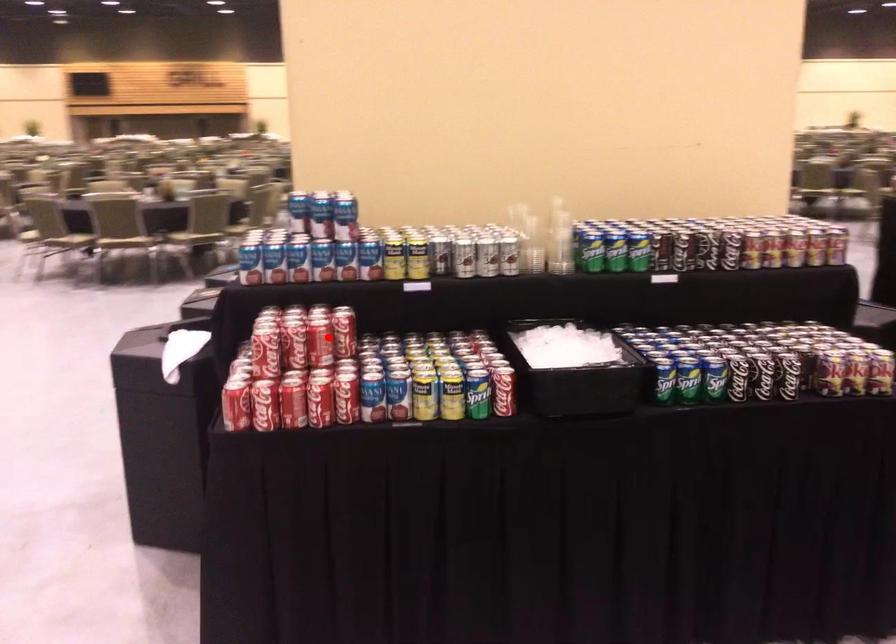
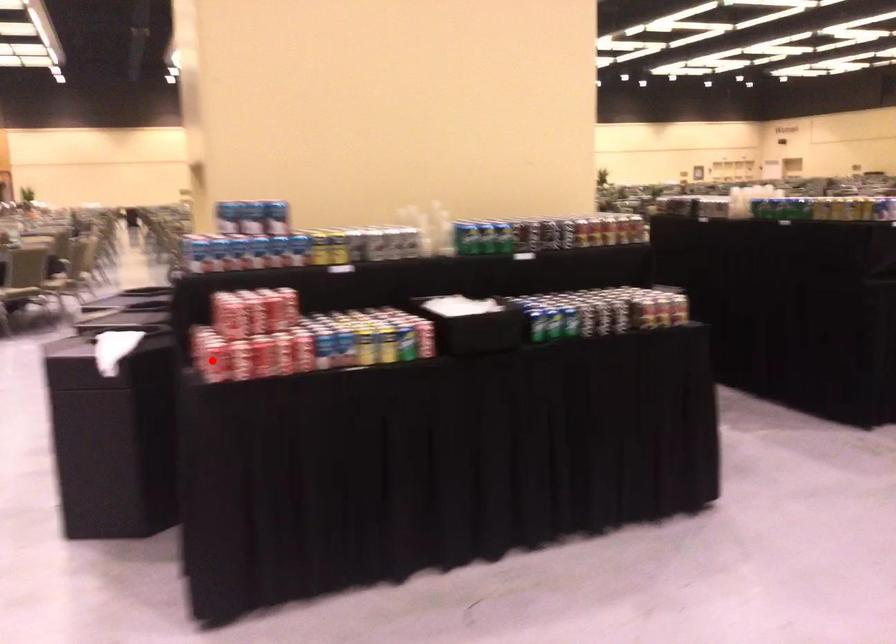
I am providing you with two images of the same scene from different viewpoints. A red point is marked on the first image and another point is marked on the second image. Do the highlighted points in image1 and image2 indicate the same real-world spot?

No